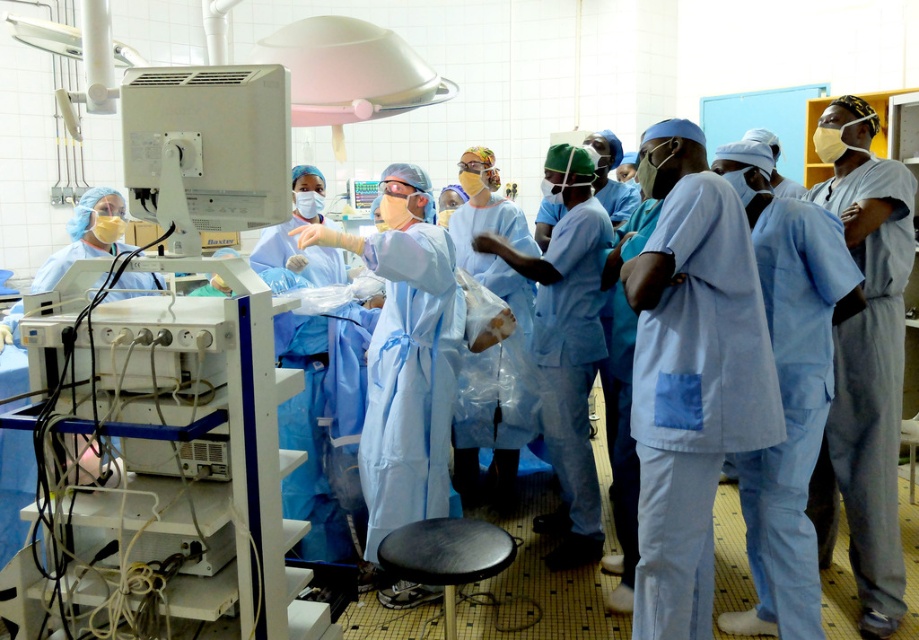
The height and width of the screenshot is (640, 919). In order to click on light blue scrubs at center in this screenshot , I will do click(691, 374).

Can you confirm if light blue scrubs at center is positioned to the left of blue scrubs at center?

Correct, you'll find light blue scrubs at center to the left of blue scrubs at center.

This screenshot has height=640, width=919. In order to click on light blue scrubs at center in this screenshot , I will do `click(691, 374)`.